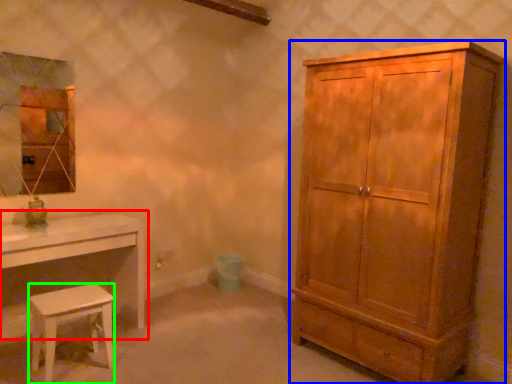
Question: Which is nearer to the table (highlighted by a red box)? cabinetry (highlighted by a blue box) or stool (highlighted by a green box).

Choices:
 (A) cabinetry
 (B) stool

Answer: (B)